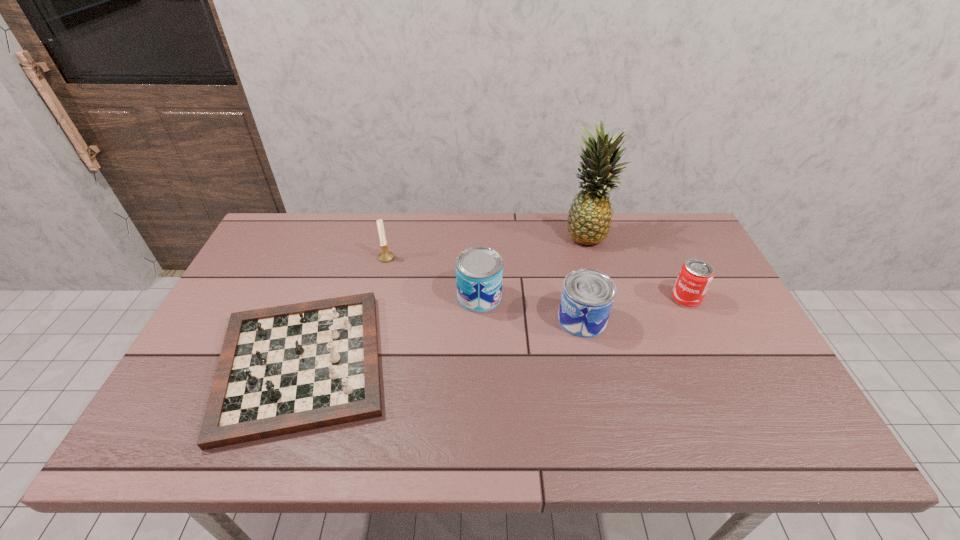
Where is `object that is at the near left corner`? The image size is (960, 540). object that is at the near left corner is located at coordinates (286, 369).

This screenshot has width=960, height=540. I want to click on vacant space at the far edge, so click(x=336, y=248).

The width and height of the screenshot is (960, 540). In order to click on vacant region at the near edge of the desktop in this screenshot , I will do `click(517, 444)`.

In the image, there is a desktop. Identify the location of vacant space at the left edge. coord(280,294).

At what (x,y) coordinates should I click in order to perform the action: click on free space at the right edge. Please return your answer as a coordinate pair (x, y). Image resolution: width=960 pixels, height=540 pixels. Looking at the image, I should click on (695, 310).

This screenshot has height=540, width=960. In the image, there is a desktop. Find the location of `vacant space at the near left corner`. vacant space at the near left corner is located at coordinates (187, 439).

In the image, there is a desktop. Where is `vacant space at the far right corner`? vacant space at the far right corner is located at coordinates (647, 231).

This screenshot has width=960, height=540. I want to click on free space between the farthest object and the rightmost can, so click(636, 267).

Locate an element on the screen. The image size is (960, 540). free point between the rightmost can and the shortest object is located at coordinates (493, 331).

Locate an element on the screen. The image size is (960, 540). free space between the chessboard and the second can from right to left is located at coordinates (442, 342).